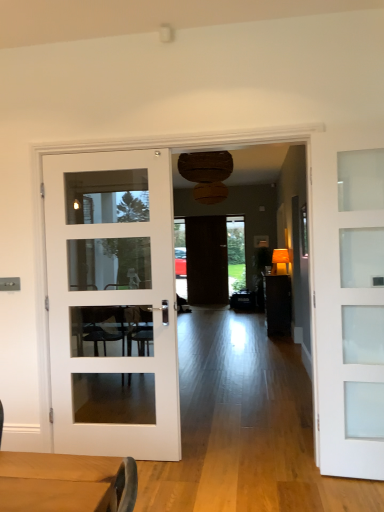
Question: Is white frosted glass door at right, the 1th door viewed from the right, positioned with its back to matte brown table at center?

Choices:
 (A) yes
 (B) no

Answer: (A)

Question: Considering the relative sizes of white frosted glass door at right, the third door positioned from the back, and matte brown table at center in the image provided, is white frosted glass door at right, the third door positioned from the back, bigger than matte brown table at center?

Choices:
 (A) yes
 (B) no

Answer: (B)

Question: Would you say white frosted glass door at right, the 3th door from the left, contains matte brown table at center?

Choices:
 (A) yes
 (B) no

Answer: (B)

Question: Is white frosted glass door at right, the third door positioned from the back, outside of matte brown table at center?

Choices:
 (A) yes
 (B) no

Answer: (A)

Question: Does white frosted glass door at right, the 3th door from the left, lie behind matte brown table at center?

Choices:
 (A) no
 (B) yes

Answer: (A)

Question: Could you tell me if white frosted glass door at right, the 3th door from the left, is turned towards matte brown table at center?

Choices:
 (A) no
 (B) yes

Answer: (A)

Question: Considering the relative sizes of dark wood door at center, which is the 1th door in back-to-front order, and matte brown table at center in the image provided, is dark wood door at center, which is the 1th door in back-to-front order, wider than matte brown table at center?

Choices:
 (A) yes
 (B) no

Answer: (B)

Question: From a real-world perspective, is dark wood door at center, the 2th door from the left, beneath matte brown table at center?

Choices:
 (A) no
 (B) yes

Answer: (A)

Question: Is dark wood door at center, which appears as the second door when viewed from the right, completely or partially outside of matte brown table at center?

Choices:
 (A) no
 (B) yes

Answer: (B)

Question: Can you confirm if dark wood door at center, which is the 1th door in back-to-front order, is taller than matte brown table at center?

Choices:
 (A) yes
 (B) no

Answer: (A)

Question: Is dark wood door at center, which is the 1th door in back-to-front order, to the left of matte brown table at center from the viewer's perspective?

Choices:
 (A) yes
 (B) no

Answer: (A)

Question: Is dark wood door at center, the 3th door from the front, positioned behind matte brown table at center?

Choices:
 (A) no
 (B) yes

Answer: (B)

Question: Does white glass door at left, the 3th door when ordered from right to left, have a lesser width compared to dark wood door at center, the 2th door from the left?

Choices:
 (A) yes
 (B) no

Answer: (B)